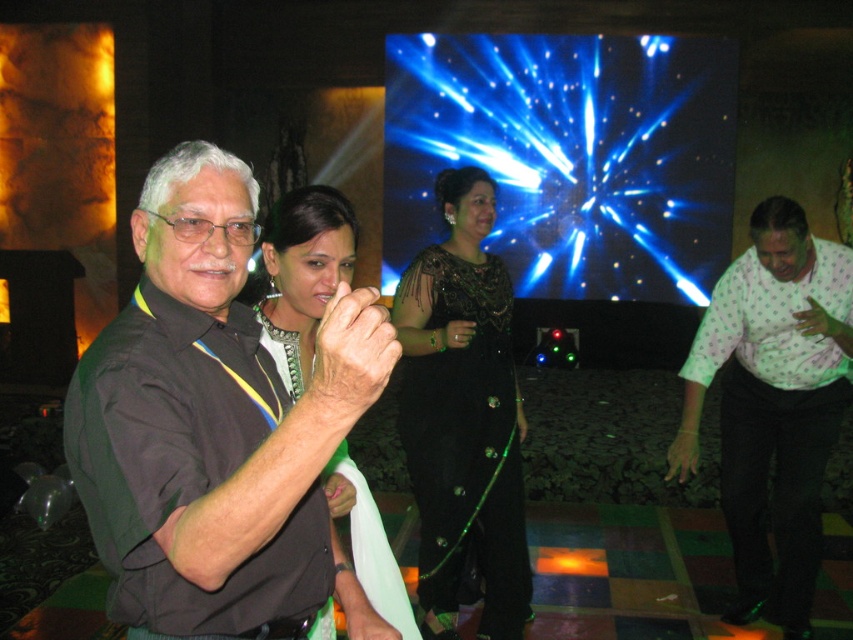
In the scene shown: You are standing in the banquet hall and want to take a photo of both the man with white hair and the woman with dark hair. Which of the two points, point (798, 216) or point (474, 451), is closer to you?

Point (798, 216) is closer to the camera than point (474, 451), so it is closer to you.

In the image, there is a man with white hair wearing glasses and a dark shirt with yellow accents, and a point labeled at coordinates (773, 403). What object is located at that point?

The white dotted shirt at right is located at point (773, 403).